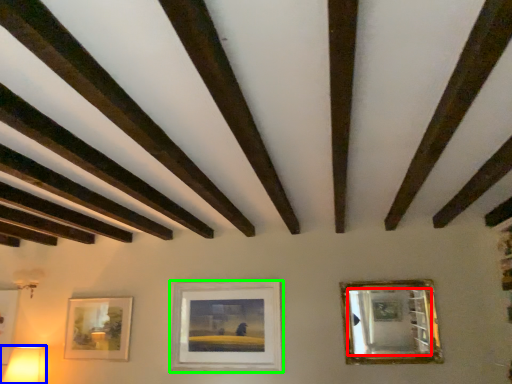
Question: Estimate the real-world distances between objects in this image. Which object is farther from mirror (highlighted by a red box), table lamp (highlighted by a blue box) or picture frame (highlighted by a green box)?

Choices:
 (A) table lamp
 (B) picture frame

Answer: (A)